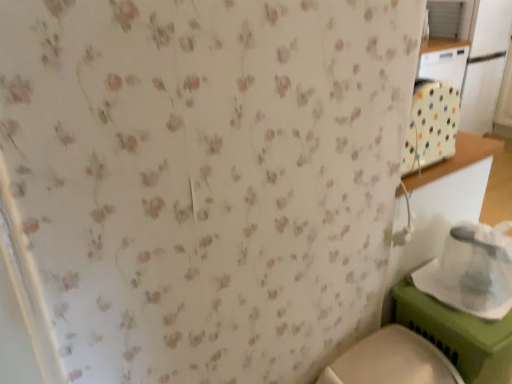
Question: In the image, is white glossy toilet at lower right positioned in front of or behind white plastic container at lower right?

Choices:
 (A) behind
 (B) front

Answer: (B)

Question: In terms of height, does white glossy toilet at lower right look taller or shorter compared to white plastic container at lower right?

Choices:
 (A) tall
 (B) short

Answer: (A)

Question: From the image's perspective, is white glossy toilet at lower right positioned above or below white plastic container at lower right?

Choices:
 (A) above
 (B) below

Answer: (B)

Question: Is white plastic container at lower right in front of or behind white glossy toilet at lower right in the image?

Choices:
 (A) front
 (B) behind

Answer: (B)

Question: Based on their positions, is white plastic container at lower right located to the left or right of white glossy toilet at lower right?

Choices:
 (A) right
 (B) left

Answer: (A)

Question: In terms of size, does white plastic container at lower right appear bigger or smaller than white glossy toilet at lower right?

Choices:
 (A) small
 (B) big

Answer: (A)

Question: From a real-world perspective, relative to white glossy toilet at lower right, is white plastic container at lower right vertically above or below?

Choices:
 (A) below
 (B) above

Answer: (B)